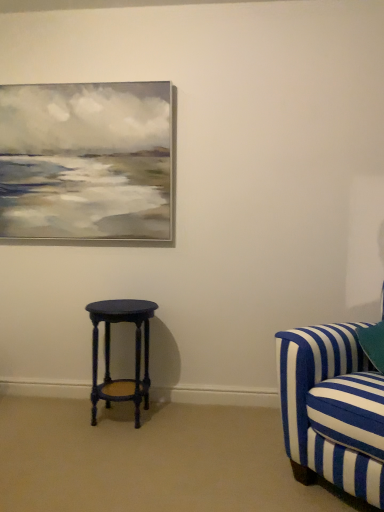
In order to click on matte dark blue stool at lower left in this screenshot , I will do `click(109, 353)`.

The image size is (384, 512). What do you see at coordinates (109, 353) in the screenshot? I see `matte dark blue stool at lower left` at bounding box center [109, 353].

I want to click on blue striped fabric couch at right, so click(306, 409).

Describe the element at coordinates (306, 409) in the screenshot. I see `blue striped fabric couch at right` at that location.

In order to click on matte dark blue stool at lower left in this screenshot , I will do `click(109, 353)`.

Which is more to the left, matte dark blue stool at lower left or blue striped fabric couch at right?

From the viewer's perspective, matte dark blue stool at lower left appears more on the left side.

Between matte dark blue stool at lower left and blue striped fabric couch at right, which one is positioned behind?

matte dark blue stool at lower left is more distant.

Considering the positions of point (96, 328) and point (354, 341), is point (96, 328) closer or farther from the camera than point (354, 341)?

Point (96, 328).

From the image's perspective, which one is positioned higher, matte dark blue stool at lower left or blue striped fabric couch at right?

blue striped fabric couch at right.

From a real-world perspective, is matte dark blue stool at lower left positioned under blue striped fabric couch at right based on gravity?

Yes, from a real-world perspective, matte dark blue stool at lower left is under blue striped fabric couch at right.

Looking at this image, looking at their sizes, would you say matte dark blue stool at lower left is wider or thinner than blue striped fabric couch at right?

Considering their sizes, matte dark blue stool at lower left looks slimmer than blue striped fabric couch at right.

Who is taller, matte dark blue stool at lower left or blue striped fabric couch at right?

Standing taller between the two is blue striped fabric couch at right.

Who is bigger, matte dark blue stool at lower left or blue striped fabric couch at right?

blue striped fabric couch at right is bigger.

Is matte dark blue stool at lower left spatially inside blue striped fabric couch at right, or outside of it?

matte dark blue stool at lower left is not inside blue striped fabric couch at right, it's outside.

Are matte dark blue stool at lower left and blue striped fabric couch at right beside each other?

No, matte dark blue stool at lower left is not making contact with blue striped fabric couch at right.

Is matte dark blue stool at lower left oriented towards blue striped fabric couch at right?

No, matte dark blue stool at lower left does not turn towards blue striped fabric couch at right.

What's the angular difference between matte dark blue stool at lower left and blue striped fabric couch at right's facing directions?

The angular difference between matte dark blue stool at lower left and blue striped fabric couch at right is 47.5 degrees.

How much distance is there between matte dark blue stool at lower left and blue striped fabric couch at right?

36.89 inches.

Find the location of `studio couch located in front of the matte dark blue stool at lower left`. studio couch located in front of the matte dark blue stool at lower left is located at coordinates (306, 409).

Considering the relative positions of blue striped fabric couch at right and matte dark blue stool at lower left in the image provided, is blue striped fabric couch at right to the left of matte dark blue stool at lower left from the viewer's perspective?

No.

Is the position of blue striped fabric couch at right less distant than that of matte dark blue stool at lower left?

Yes, it is in front of matte dark blue stool at lower left.

Considering the positions of point (281, 369) and point (121, 310), is point (281, 369) closer or farther from the camera than point (121, 310)?

Clearly, point (281, 369) is closer to the camera than point (121, 310).

From the image's perspective, which one is positioned higher, blue striped fabric couch at right or matte dark blue stool at lower left?

blue striped fabric couch at right appears higher in the image.

From a real-world perspective, is blue striped fabric couch at right positioned above or below matte dark blue stool at lower left?

blue striped fabric couch at right is situated higher than matte dark blue stool at lower left in the real world.

Considering the sizes of objects blue striped fabric couch at right and matte dark blue stool at lower left in the image provided, who is thinner, blue striped fabric couch at right or matte dark blue stool at lower left?

matte dark blue stool at lower left is thinner.

Between blue striped fabric couch at right and matte dark blue stool at lower left, which one has more height?

blue striped fabric couch at right is taller.

Who is bigger, blue striped fabric couch at right or matte dark blue stool at lower left?

Bigger between the two is blue striped fabric couch at right.

Choose the correct answer: Is blue striped fabric couch at right inside matte dark blue stool at lower left or outside it?

blue striped fabric couch at right is not enclosed by matte dark blue stool at lower left.

Is blue striped fabric couch at right positioned far away from matte dark blue stool at lower left?

They are positioned close to each other.

Is blue striped fabric couch at right facing towards matte dark blue stool at lower left?

No.

The height and width of the screenshot is (512, 384). What are the coordinates of `studio couch above the matte dark blue stool at lower left (from a real-world perspective)` in the screenshot? It's located at (306, 409).

Identify the location of studio couch above the matte dark blue stool at lower left (from a real-world perspective). This screenshot has height=512, width=384. (306, 409).

At what (x,y) coordinates should I click in order to perform the action: click on stool on the left of blue striped fabric couch at right. Please return your answer as a coordinate pair (x, y). Looking at the image, I should click on (109, 353).